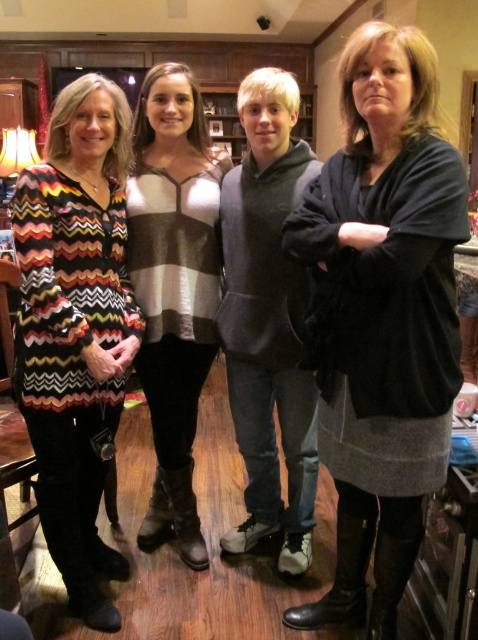
You are trying to decide which sweater to take home. Both the dark gray sweater at center and the striped sweater at center are available. Which one has a larger size?

The dark gray sweater at center is bigger than the striped sweater at center, so the dark gray sweater at center has a larger size.